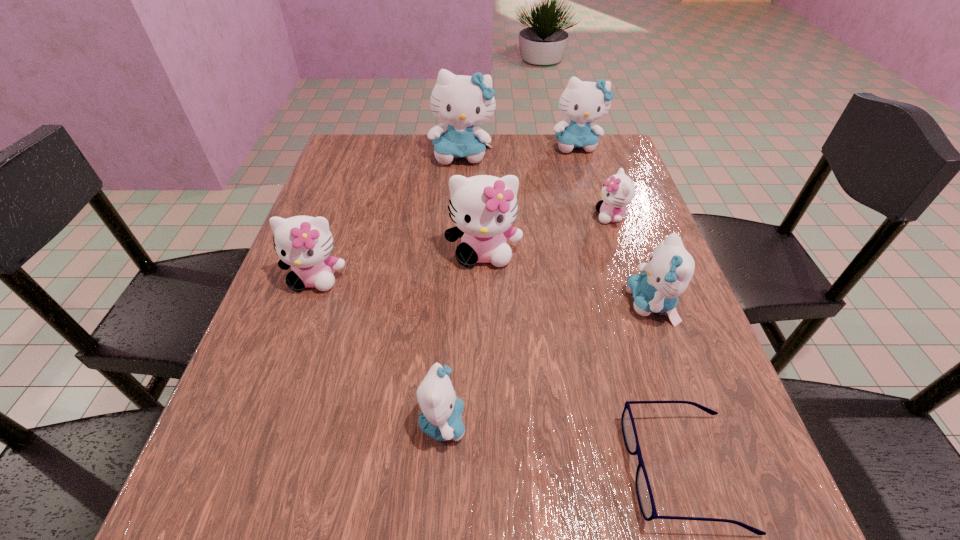
Find the location of `white kitten that can be found as the second closest to the farthest white kitten`. white kitten that can be found as the second closest to the farthest white kitten is located at coordinates (303, 242).

Identify which white kitten is located as the nearest to the second white kitten from right to left. Please provide its 2D coordinates. Your answer should be formatted as a tuple, i.e. [(x, y)], where the tuple contains the x and y coordinates of a point satisfying the conditions above.

[(618, 191)]